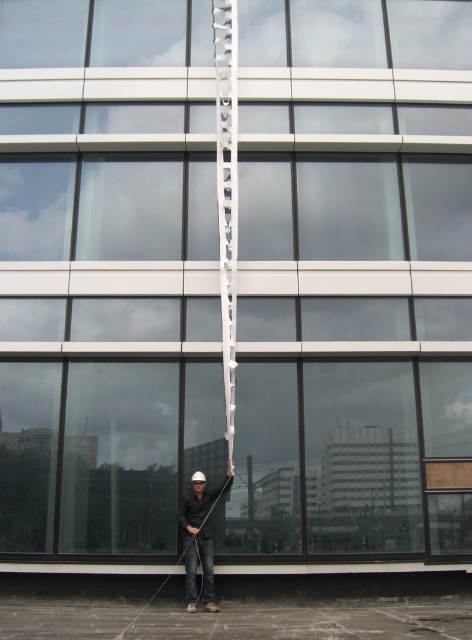
You are a safety inspector evaluating the setup of equipment in the image. The white metallic ladder at center and the black matte rope at center are both present. According to safety guidelines, the ladder must be placed to the left of the rope to avoid entanglement. Is the current placement compliant with the guidelines?

The white metallic ladder at center is positioned on the right side of black matte rope at center, which means it is not placed to the left as required by the guidelines. Therefore, the current placement is noncompliant.

You are standing at the base of the building and want to reach the top floor, which is 10 meters high. You have a white metallic ladder at center. Can you safely climb the ladder to reach the top floor?

The white metallic ladder at center is 9.90 meters away from the viewer. Since the top floor is 10 meters high, the ladder is slightly shorter than required, so it may not safely reach the top floor.

You are a construction worker standing at the base of the building holding a ladder. You notice two points marked on the ladder at coordinates point (204, 561) and point (134, 632). Which point is closer to the ground?

Point (134, 632) is closer to the ground because it is in front of point (204, 561), which is behind it.